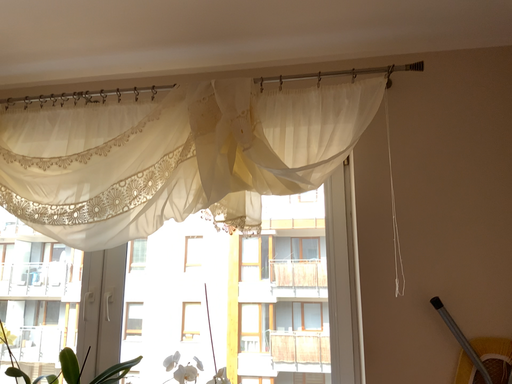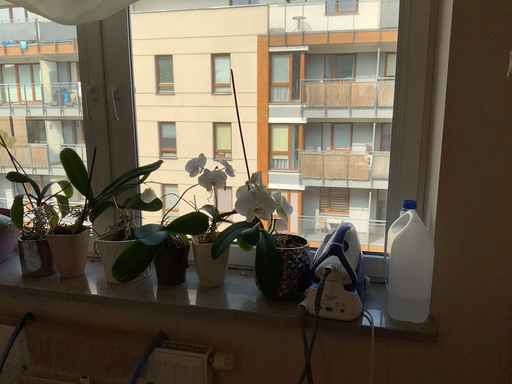
Question: How did the camera likely rotate when shooting the video?

Choices:
 (A) rotated upward
 (B) rotated downward

Answer: (B)